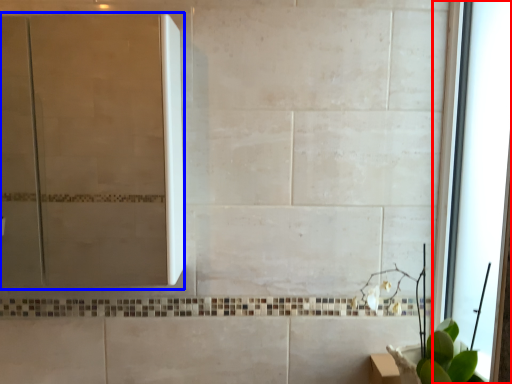
Question: Which object is closer to the camera taking this photo, window (highlighted by a red box) or screen door (highlighted by a blue box)?

Choices:
 (A) window
 (B) screen door

Answer: (A)